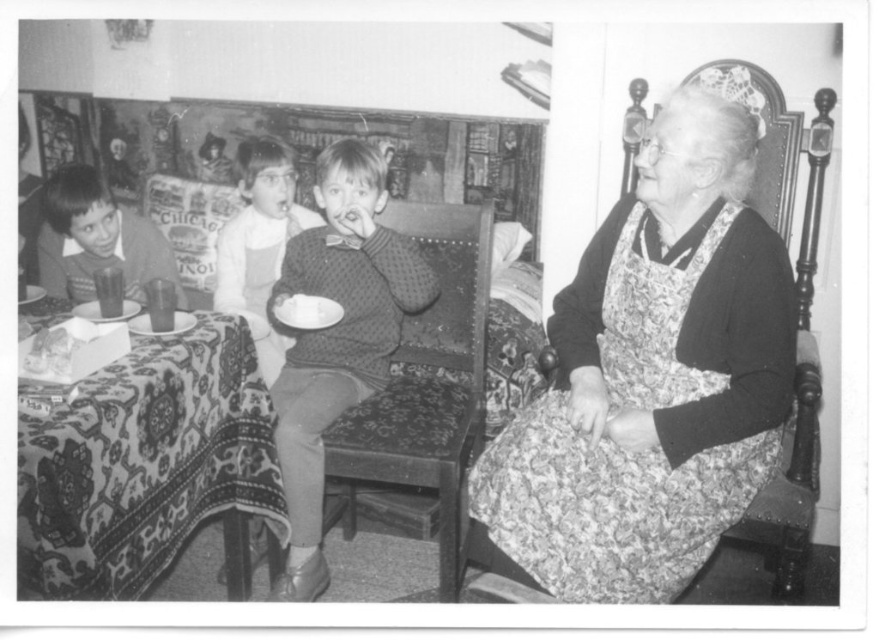
Is smooth plastic cup at left bigger than white fluffy cake at center?

Yes.

Between point (120, 234) and point (298, 305), which one is positioned behind?

Positioned behind is point (120, 234).

This screenshot has height=640, width=879. In order to click on smooth plastic cup at left in this screenshot , I will do `click(97, 240)`.

Is knitted sweater at center taller than white fluffy cake at center?

Yes.

This screenshot has height=640, width=879. What do you see at coordinates (338, 337) in the screenshot?
I see `knitted sweater at center` at bounding box center [338, 337].

You are a GUI agent. You are given a task and a screenshot of the screen. Output one action in this format:
    pyautogui.click(x=<x>, y=<y>)
    Task: Click on the knitted sweater at center
    The image size is (879, 640).
    Given the screenshot: What is the action you would take?
    pyautogui.click(x=338, y=337)

Is point (314, 237) more distant than point (248, 216)?

No, it is in front of (248, 216).

Is knitted sweater at center to the right of smooth sweater at center from the viewer's perspective?

Yes, knitted sweater at center is to the right of smooth sweater at center.

The height and width of the screenshot is (640, 879). Identify the location of knitted sweater at center. (338, 337).

You are a GUI agent. You are given a task and a screenshot of the screen. Output one action in this format:
    pyautogui.click(x=<x>, y=<y>)
    Task: Click on the knitted sweater at center
    Image resolution: width=879 pixels, height=640 pixels.
    Given the screenshot: What is the action you would take?
    pyautogui.click(x=338, y=337)